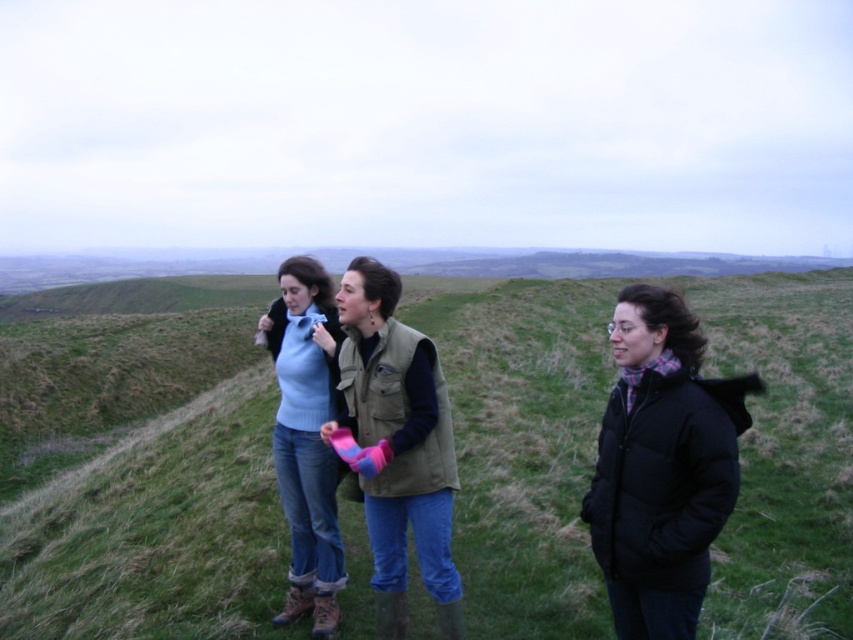
Question: Can you confirm if green grassy hillside at center is wider than khaki fabric vest at center?

Choices:
 (A) yes
 (B) no

Answer: (A)

Question: Does black puffy jacket at center have a lesser width compared to khaki fabric vest at center?

Choices:
 (A) no
 (B) yes

Answer: (B)

Question: Is green grassy hillside at center further to camera compared to black puffy jacket at center?

Choices:
 (A) no
 (B) yes

Answer: (B)

Question: Which of the following is the farthest from the observer?

Choices:
 (A) green grassy hillside at center
 (B) black puffy jacket at center

Answer: (A)

Question: Among these points, which one is farthest from the camera?

Choices:
 (A) (383, 486)
 (B) (656, 490)
 (C) (799, 557)

Answer: (C)

Question: Which point is closer to the camera?

Choices:
 (A) light blue sweater at center
 (B) khaki fabric vest at center
 (C) green grassy hillside at center

Answer: (B)